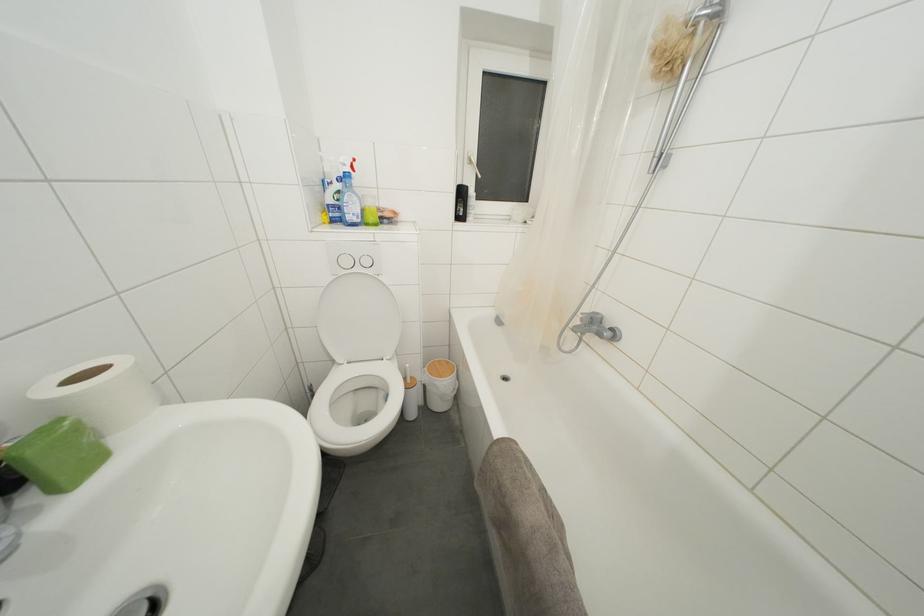
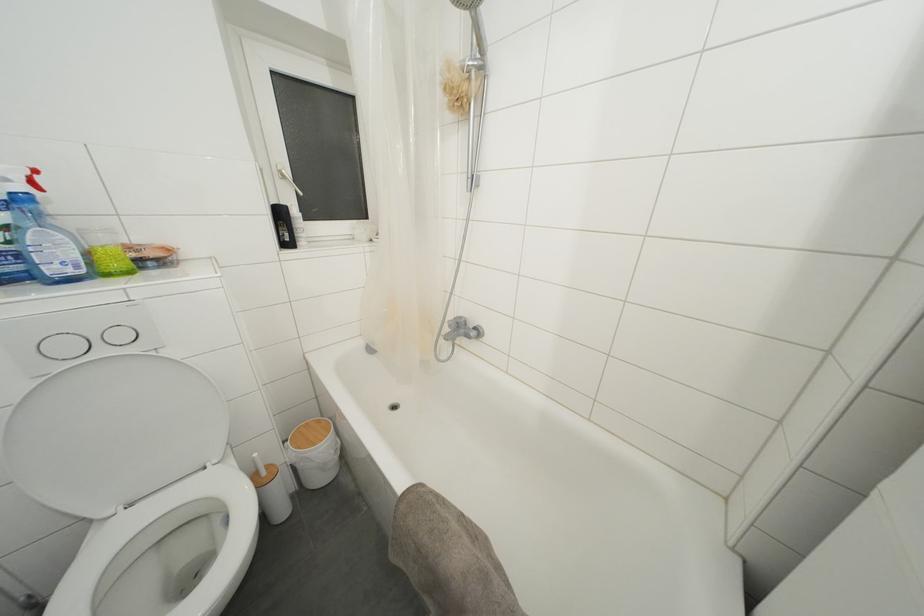
Question: The camera is either moving clockwise (left) or counter-clockwise (right) around the object. The first image is from the beginning of the video and the second image is from the end. Is the camera moving left or right when shooting the video?

Choices:
 (A) Left
 (B) Right

Answer: (A)